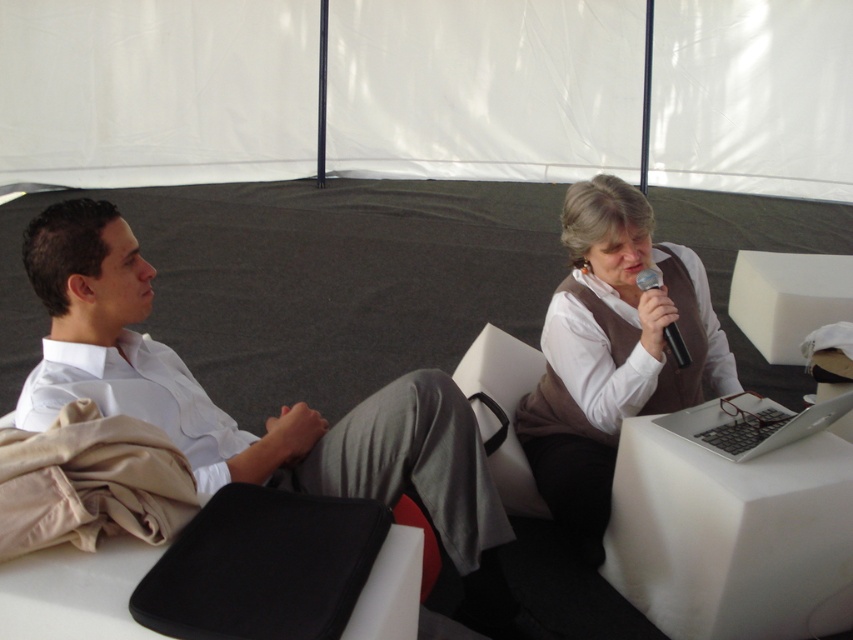
Based on the photo, is matte brown vest at upper right positioned in front of silver metallic laptop at lower right?

That is False.

Does point (625, 184) lie in front of point (791, 413)?

Yes, point (625, 184) is closer to viewer.

Describe the element at coordinates (612, 353) in the screenshot. I see `matte brown vest at upper right` at that location.

You are a GUI agent. You are given a task and a screenshot of the screen. Output one action in this format:
    pyautogui.click(x=<x>, y=<y>)
    Task: Click on the matte brown vest at upper right
    This screenshot has width=853, height=640.
    Given the screenshot: What is the action you would take?
    pyautogui.click(x=612, y=353)

Is silver metallic laptop at lower right wider than black plastic microphone at upper right?

Yes, silver metallic laptop at lower right is wider than black plastic microphone at upper right.

Between silver metallic laptop at lower right and black plastic microphone at upper right, which one is positioned higher?

black plastic microphone at upper right is above.

Which is behind, point (827, 412) or point (654, 285)?

Point (654, 285)

Locate an element on the screen. This screenshot has width=853, height=640. silver metallic laptop at lower right is located at coordinates click(x=750, y=422).

Between matte brown vest at upper right and black plastic microphone at upper right, which one is positioned higher?

black plastic microphone at upper right is higher up.

Who is taller, matte brown vest at upper right or black plastic microphone at upper right?

With more height is matte brown vest at upper right.

Between point (675, 372) and point (677, 364), which one is positioned behind?

The point (675, 372) is more distant.

Find the location of a particular element. matte brown vest at upper right is located at coordinates (612, 353).